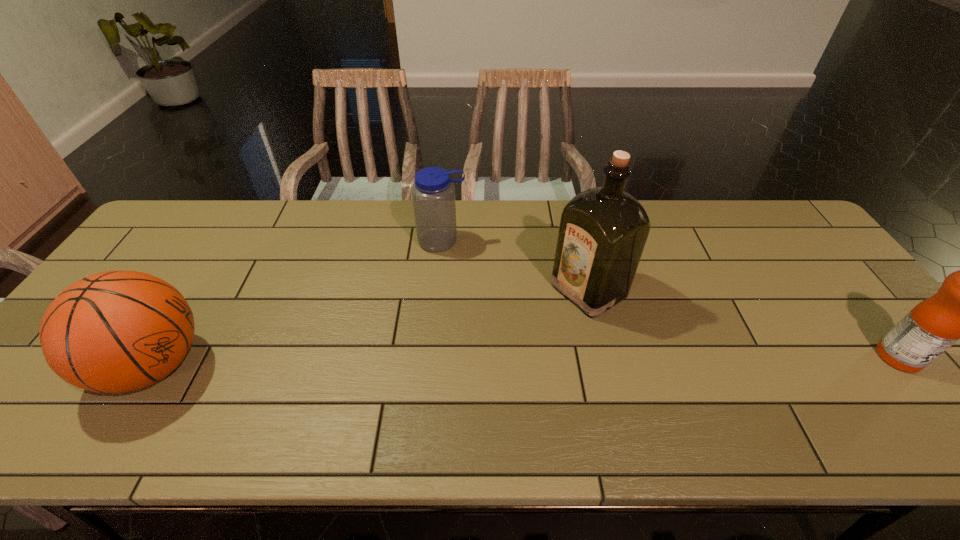
Locate an element on the screen. free space on the desktop that is between the basketball and the rightmost object and is positioned with a carrying loop on the side of the third object from right to left is located at coordinates (455, 362).

At what (x,y) coordinates should I click in order to perform the action: click on free space on the desktop that is between the leftmost object and the fruit juice and is positioned on the label of the third nearest object. Please return your answer as a coordinate pair (x, y). The width and height of the screenshot is (960, 540). Looking at the image, I should click on (470, 362).